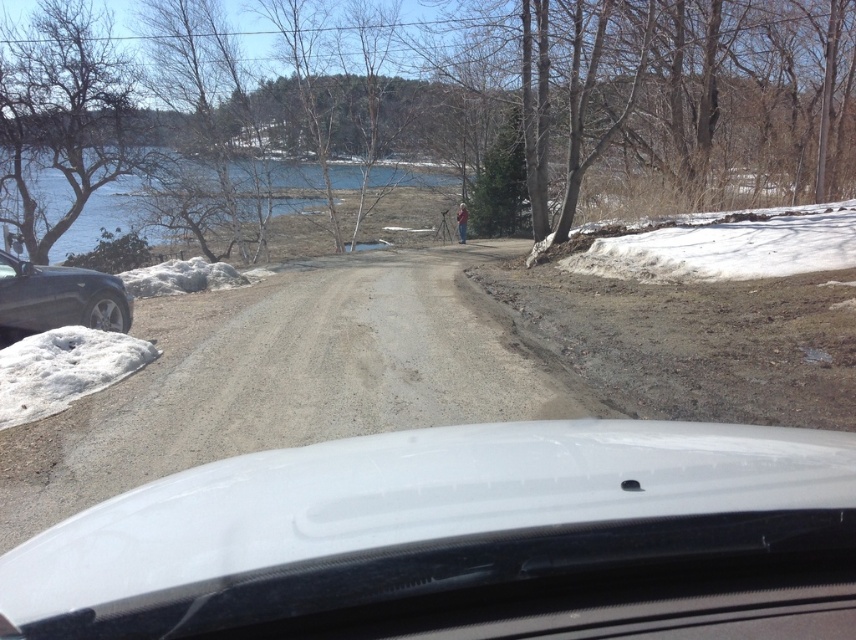
Question: Which object is farther from the camera taking this photo?

Choices:
 (A) gray gravel road at center
 (B) shiny black sedan at left
 (C) blue water at upper left

Answer: (C)

Question: Is white glossy windshield at center below gray gravel road at center?

Choices:
 (A) yes
 (B) no

Answer: (A)

Question: Does white glossy windshield at center appear on the left side of gray gravel road at center?

Choices:
 (A) no
 (B) yes

Answer: (A)

Question: Can you confirm if white glossy windshield at center is wider than shiny black sedan at left?

Choices:
 (A) yes
 (B) no

Answer: (A)

Question: Among these objects, which one is farthest from the camera?

Choices:
 (A) shiny black sedan at left
 (B) gray gravel road at center
 (C) white glossy windshield at center
 (D) blue water at upper left

Answer: (D)

Question: Which object appears farthest from the camera in this image?

Choices:
 (A) shiny black sedan at left
 (B) blue water at upper left
 (C) white glossy windshield at center
 (D) gray gravel road at center

Answer: (B)